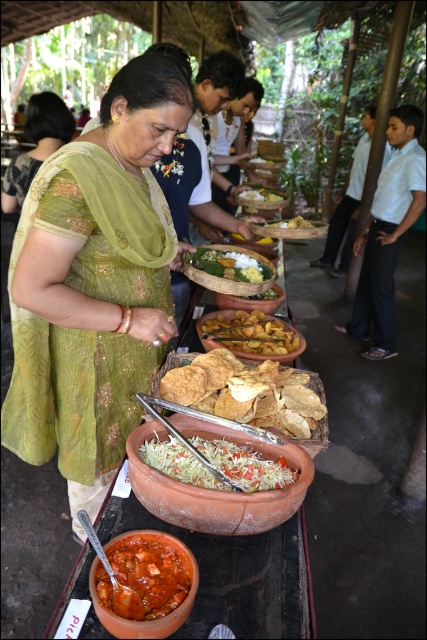
Consider the image. You are standing at the edge of the buffet table and want to grab a dish from the point closest to you. Which point, point (181, 588) or point (251, 342), is closer to your current position?

Point (181, 588) is in front of point (251, 342), so it is closer to your current position.

You are standing at the center of the image. Which object is located at the coordinates point (251, 332)?

The brown matte fried food at center is located at the coordinates point (251, 332).